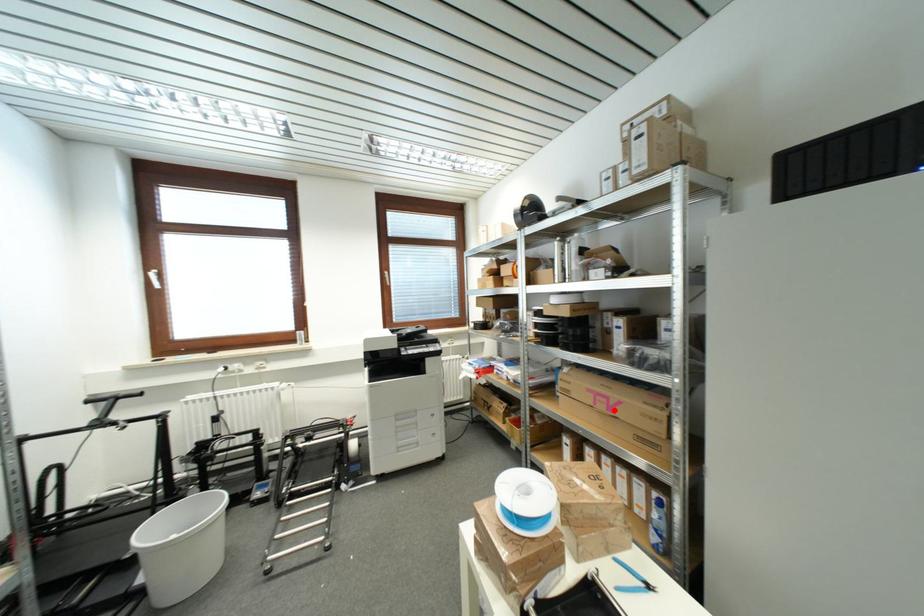
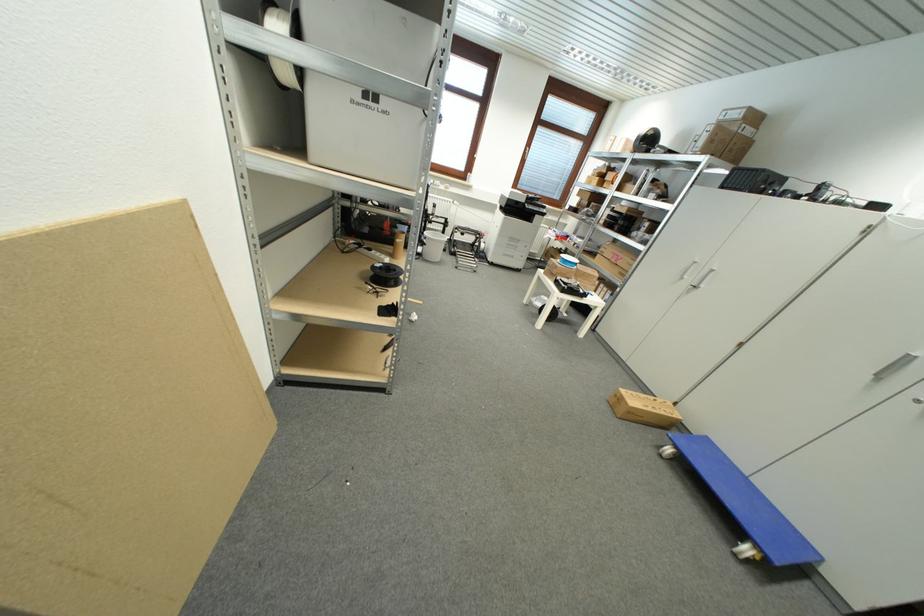
Question: A red point is marked in image1. In image2, is the corresponding 3D point closer to the camera or farther? Reply with the corresponding letter.

Choices:
 (A) The corresponding 3D point is closer.
 (B) The corresponding 3D point is farther.

Answer: (A)